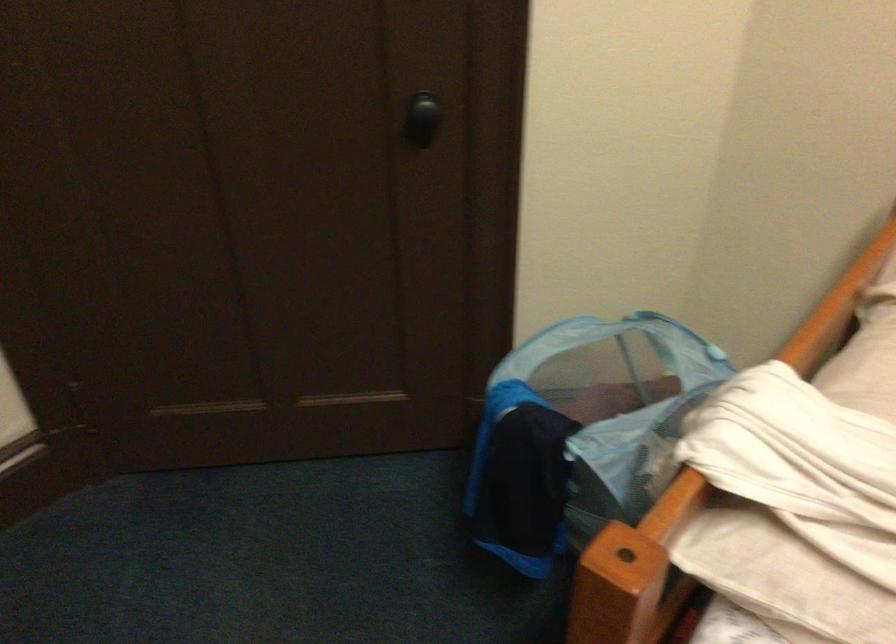
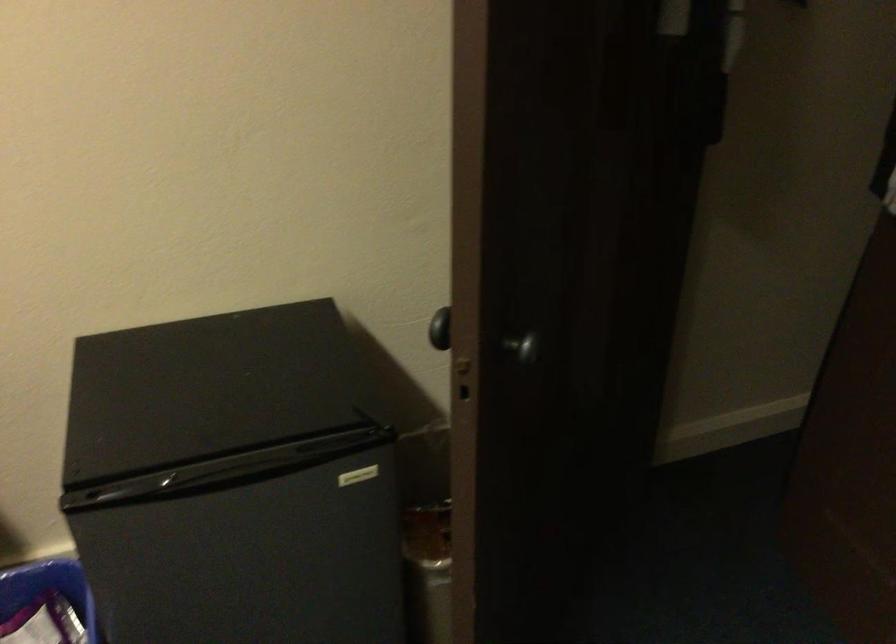
How did the camera likely rotate?

The camera's rotation is toward left-down.